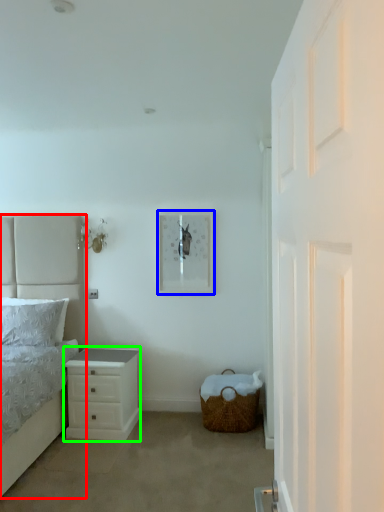
Question: Based on their relative distances, which object is farther from bed (highlighted by a red box)? Choose from picture frame (highlighted by a blue box) and chest of drawers (highlighted by a green box).

Choices:
 (A) picture frame
 (B) chest of drawers

Answer: (A)